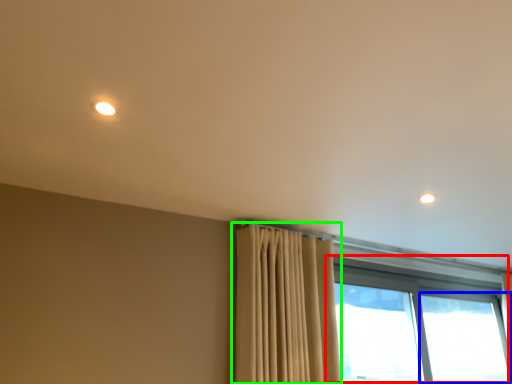
Question: Which object is positioned farthest from window (highlighted by a red box)? Select from window (highlighted by a blue box) and curtain (highlighted by a green box).

Choices:
 (A) window
 (B) curtain

Answer: (B)